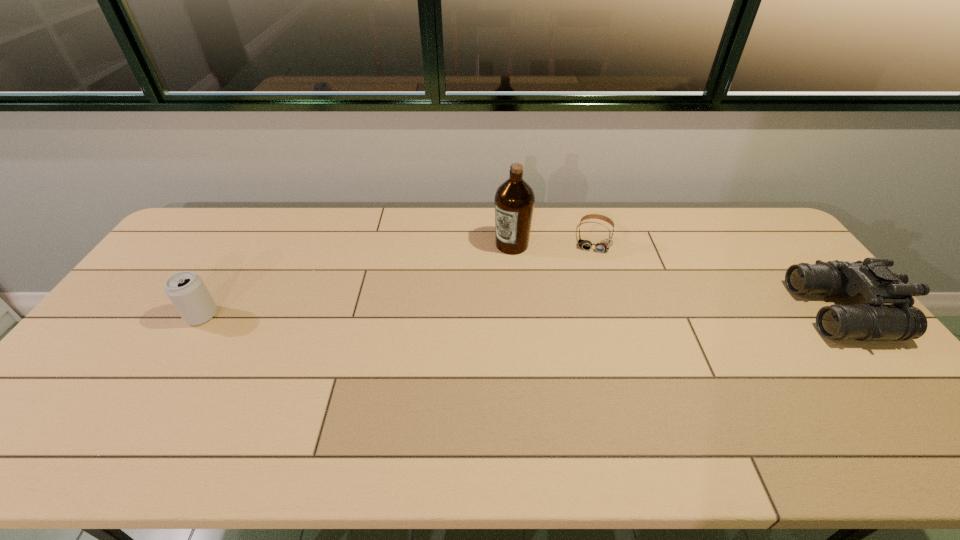
The width and height of the screenshot is (960, 540). I want to click on vacant space situated 0.200m on the front-facing side of the shortest object, so click(588, 294).

The width and height of the screenshot is (960, 540). In order to click on vacant space located 0.210m on the front-facing side of the shortest object in this screenshot , I will do `click(588, 296)`.

Where is `free region located 0.370m on the front-facing side of the shortest object`? This screenshot has height=540, width=960. free region located 0.370m on the front-facing side of the shortest object is located at coordinates pos(582,336).

Image resolution: width=960 pixels, height=540 pixels. In order to click on olive oil that is at the far edge in this screenshot , I will do `click(514, 200)`.

At what (x,y) coordinates should I click in order to perform the action: click on goggles that is at the far edge. Please return your answer as a coordinate pair (x, y). This screenshot has height=540, width=960. Looking at the image, I should click on (604, 245).

This screenshot has width=960, height=540. Identify the location of object located in the right edge section of the desktop. (889, 315).

Find the location of a particular element. Image resolution: width=960 pixels, height=540 pixels. free region at the far edge of the desktop is located at coordinates (280, 217).

Where is `blank space at the near edge of the desktop`? Image resolution: width=960 pixels, height=540 pixels. blank space at the near edge of the desktop is located at coordinates (547, 410).

The height and width of the screenshot is (540, 960). Find the location of `free space at the left edge of the desktop`. free space at the left edge of the desktop is located at coordinates (141, 309).

Where is `vacant space at the right edge of the desktop`? The width and height of the screenshot is (960, 540). vacant space at the right edge of the desktop is located at coordinates (790, 309).